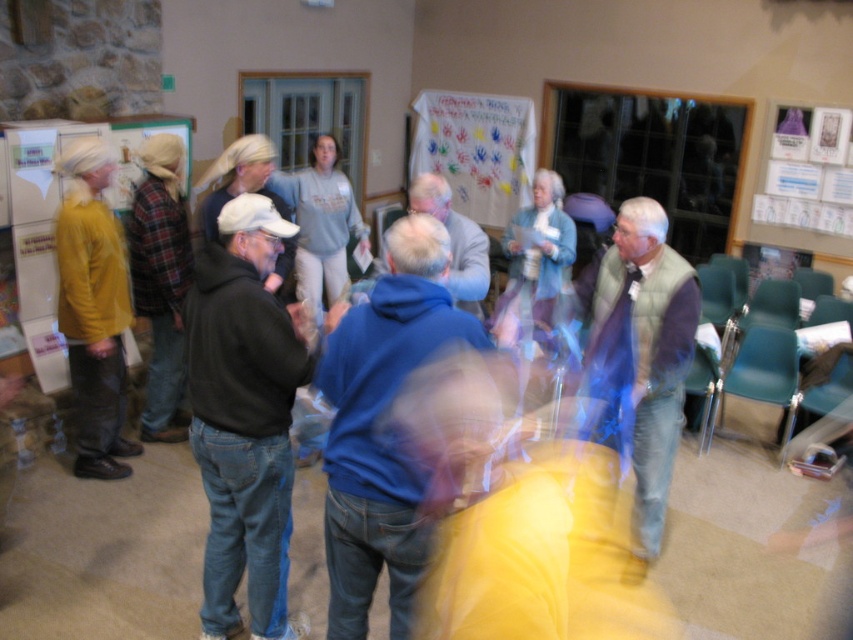
Does plaid flannel shirt at left have a lesser height compared to white paperboard at upper right?

In fact, plaid flannel shirt at left may be taller than white paperboard at upper right.

Is point (152, 196) in front of point (834, 236)?

Yes, point (152, 196) is closer to viewer.

Image resolution: width=853 pixels, height=640 pixels. I want to click on plaid flannel shirt at left, so click(x=160, y=278).

Is point (639, 477) more distant than point (799, 243)?

That is False.

What do you see at coordinates (640, 353) in the screenshot? I see `light blue vest at center` at bounding box center [640, 353].

Image resolution: width=853 pixels, height=640 pixels. What are the coordinates of `light blue vest at center` in the screenshot? It's located at (640, 353).

Is light blue vest at center positioned behind plaid flannel shirt at left?

No, it is not.

Between light blue vest at center and plaid flannel shirt at left, which one appears on the left side from the viewer's perspective?

plaid flannel shirt at left is more to the left.

Which is behind, point (660, 362) or point (148, 221)?

Point (148, 221)

Find the location of a particular element. light blue vest at center is located at coordinates (640, 353).